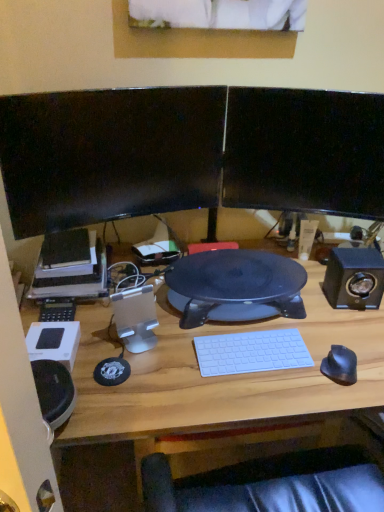
Question: Considering the relative positions of wooden desk at center and white plastic speaker at center, acting as the 1th speaker starting from the left, in the image provided, is wooden desk at center to the right of white plastic speaker at center, acting as the 1th speaker starting from the left, from the viewer's perspective?

Choices:
 (A) yes
 (B) no

Answer: (A)

Question: From the image's perspective, is wooden desk at center under white plastic speaker at center, acting as the 1th speaker starting from the left?

Choices:
 (A) yes
 (B) no

Answer: (A)

Question: Can you confirm if wooden desk at center is wider than white plastic speaker at center, marked as the 1th speaker in a front-to-back arrangement?

Choices:
 (A) no
 (B) yes

Answer: (B)

Question: Can you confirm if wooden desk at center is smaller than white plastic speaker at center, acting as the 1th speaker starting from the left?

Choices:
 (A) yes
 (B) no

Answer: (B)

Question: From a real-world perspective, is wooden desk at center positioned under white plastic speaker at center, the second speaker when ordered from back to front, based on gravity?

Choices:
 (A) no
 (B) yes

Answer: (B)

Question: Is the depth of wooden desk at center less than that of white plastic speaker at center, the second speaker when ordered from back to front?

Choices:
 (A) no
 (B) yes

Answer: (B)

Question: From the image's perspective, is black glossy monitor at upper right, the second computer monitor from the left, beneath black plastic desk at center?

Choices:
 (A) no
 (B) yes

Answer: (A)

Question: Is black glossy monitor at upper right, the second computer monitor from the left, behind black plastic desk at center?

Choices:
 (A) yes
 (B) no

Answer: (A)

Question: Can you confirm if black glossy monitor at upper right, the second computer monitor from the left, is taller than black plastic desk at center?

Choices:
 (A) no
 (B) yes

Answer: (B)

Question: Considering the relative sizes of black glossy monitor at upper right, the second computer monitor from the left, and black plastic desk at center in the image provided, is black glossy monitor at upper right, the second computer monitor from the left, shorter than black plastic desk at center?

Choices:
 (A) no
 (B) yes

Answer: (A)

Question: Considering the relative sizes of black glossy monitor at upper right, the second computer monitor from the left, and black plastic desk at center in the image provided, is black glossy monitor at upper right, the second computer monitor from the left, wider than black plastic desk at center?

Choices:
 (A) no
 (B) yes

Answer: (A)

Question: Is black plastic desk at center inside black glossy monitor at upper right, the second computer monitor from the left?

Choices:
 (A) no
 (B) yes

Answer: (A)

Question: Is black matte mouse at right looking in the opposite direction of white plastic keyboard at center?

Choices:
 (A) yes
 (B) no

Answer: (B)